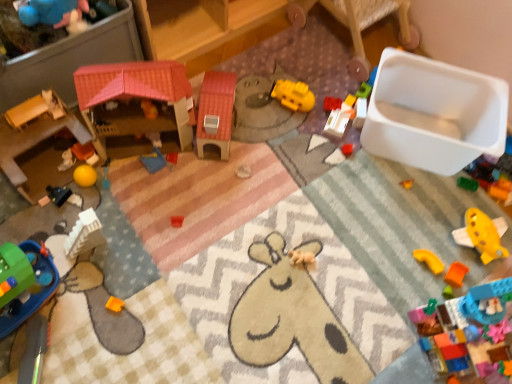
The image size is (512, 384). What are the coordinates of `vacant area that lies between orange matte block at lower right, acting as the 14th toy starting from the left, and green plastic toy at lower left, the fourteenth toy viewed from the right` in the screenshot? It's located at (226, 289).